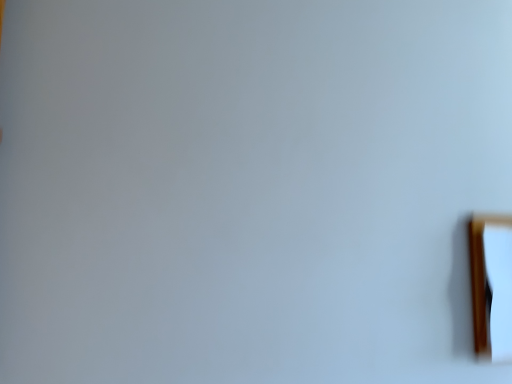
Image resolution: width=512 pixels, height=384 pixels. In order to click on wooden picture frame at right in this screenshot , I will do `click(490, 281)`.

Describe the element at coordinates (490, 281) in the screenshot. Image resolution: width=512 pixels, height=384 pixels. I see `wooden picture frame at right` at that location.

This screenshot has width=512, height=384. Identify the location of wooden picture frame at right. point(490,281).